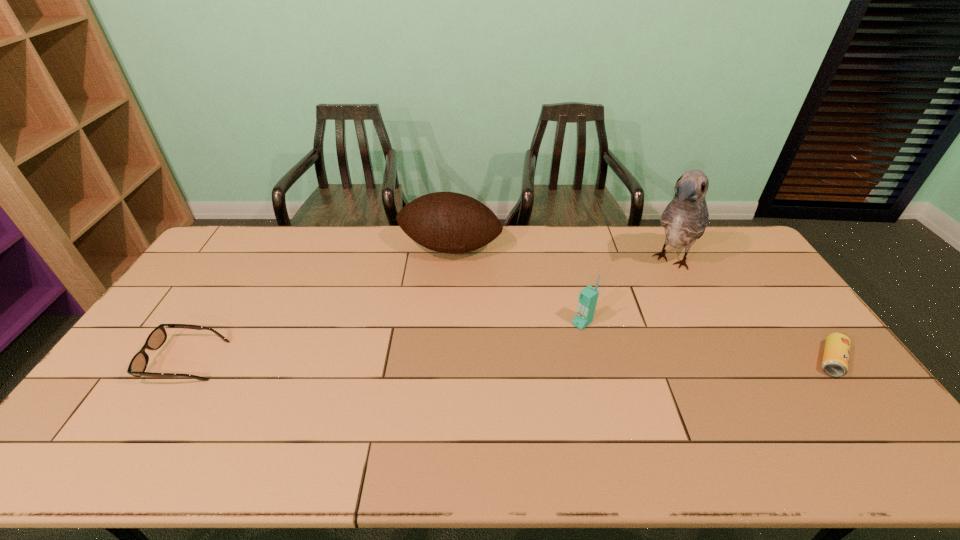
Identify the location of football that is at the far edge. This screenshot has height=540, width=960. (447, 222).

I want to click on parrot present at the far edge, so click(685, 218).

Find the location of `object located in the left edge section of the desktop`. object located in the left edge section of the desktop is located at coordinates (138, 364).

The image size is (960, 540). Identify the location of object positioned at the right edge. (835, 361).

Where is `free region at the far edge of the desktop`? free region at the far edge of the desktop is located at coordinates click(564, 245).

Image resolution: width=960 pixels, height=540 pixels. Find the location of `vacant space at the near edge of the desktop`. vacant space at the near edge of the desktop is located at coordinates (194, 400).

Image resolution: width=960 pixels, height=540 pixels. I want to click on blank space at the left edge of the desktop, so click(209, 280).

In the image, there is a desktop. Where is `free space at the right edge`? This screenshot has width=960, height=540. free space at the right edge is located at coordinates (777, 310).

In order to click on vacant space at the far left corner of the desktop in this screenshot , I will do `click(252, 229)`.

Where is `empty location between the third object from left to right and the football`? empty location between the third object from left to right and the football is located at coordinates (516, 286).